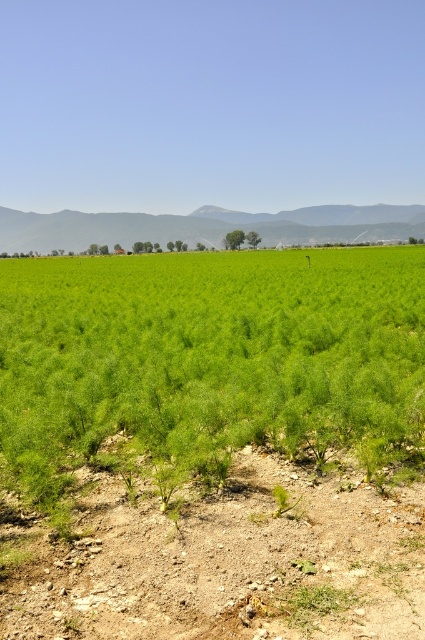
Between green leafy grass at center and dusty brown soil at lower center, which one has more height?

Standing taller between the two is green leafy grass at center.

Between green leafy grass at center and dusty brown soil at lower center, which one appears on the left side from the viewer's perspective?

Positioned to the left is green leafy grass at center.

Where is `green leafy grass at center`? green leafy grass at center is located at coordinates (209, 360).

At what (x,y) coordinates should I click in order to perform the action: click on green leafy grass at center. Please return your answer as a coordinate pair (x, y). The height and width of the screenshot is (640, 425). Looking at the image, I should click on (209, 360).